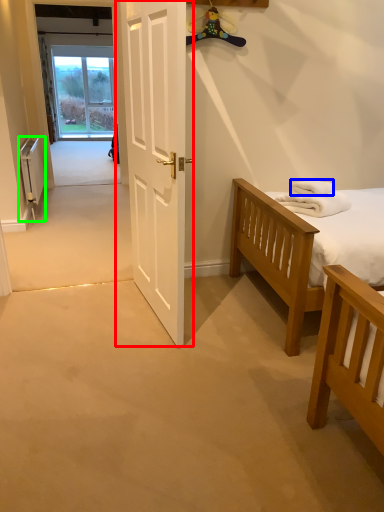
Question: Considering the real-world distances, which object is closest to door (highlighted by a red box)? towel/napkin (highlighted by a blue box) or radiator (highlighted by a green box).

Choices:
 (A) towel/napkin
 (B) radiator

Answer: (A)